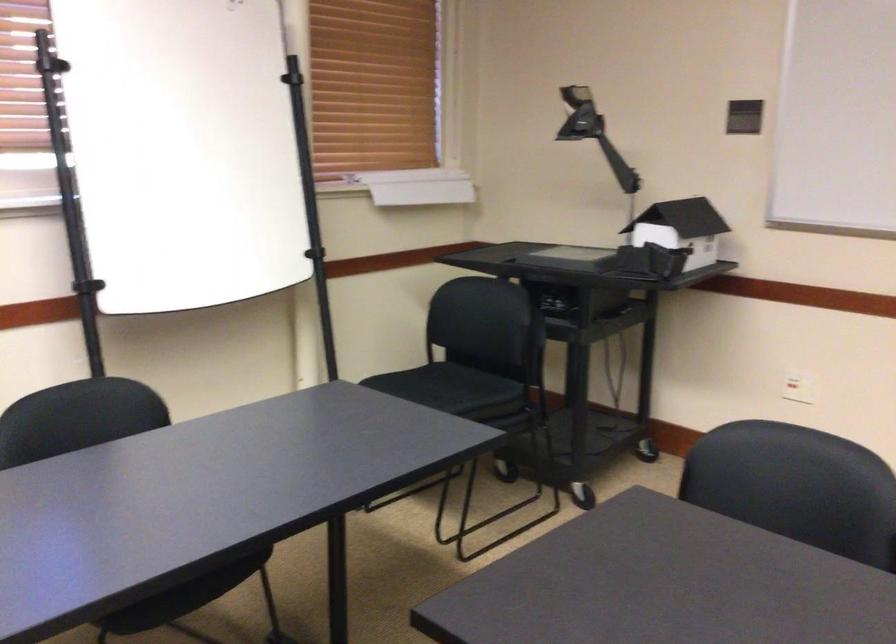
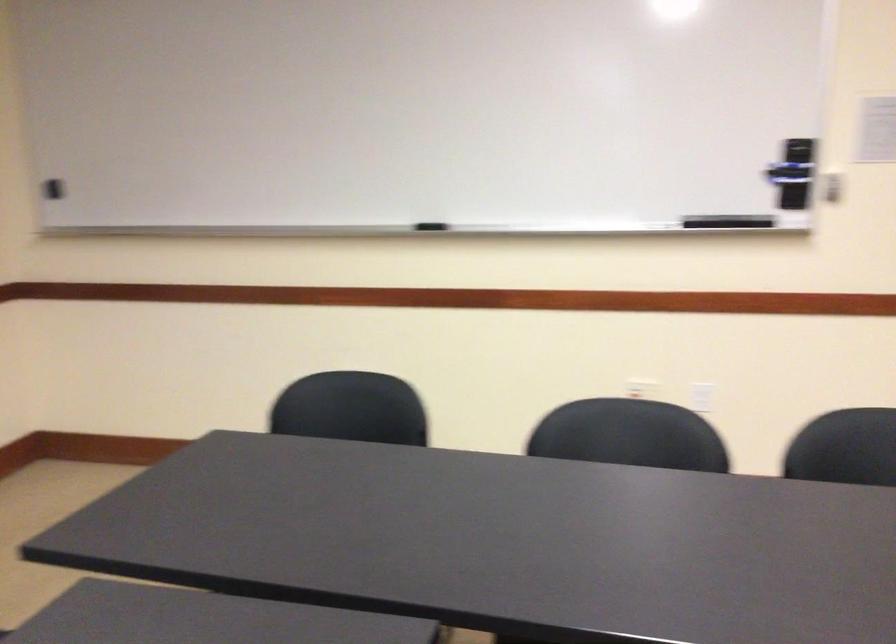
The images are taken continuously from a first-person perspective. In which direction is your viewpoint rotating?

The camera's rotation is toward right-down.